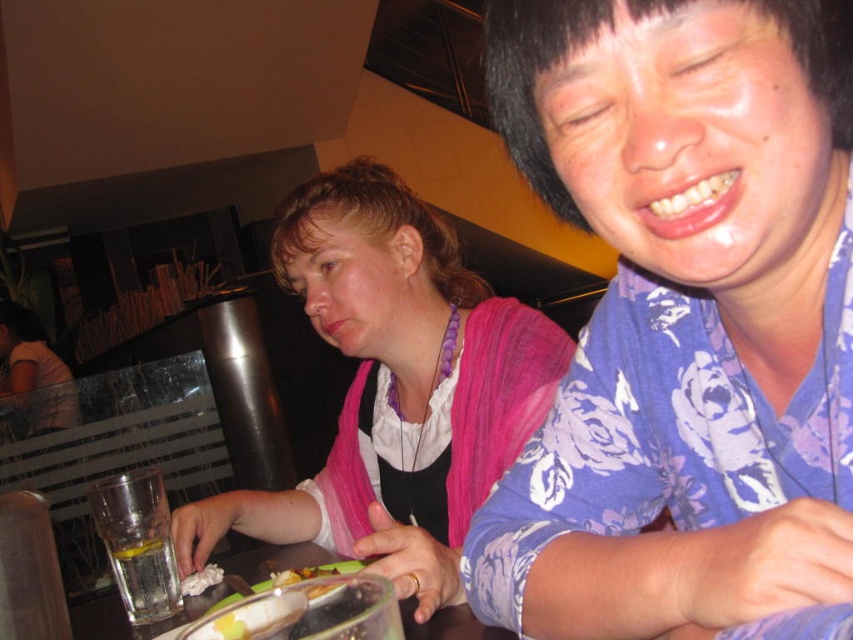
You are a photographer trying to capture a candid shot of the blue floral shirt at center and the clear glass table at center. Based on their heights, which object should you focus on first to ensure both are in frame?

The blue floral shirt at center is taller than the clear glass table at center, so you should focus on the blue floral shirt at center first to ensure both are in frame.

You are holding a 30 inch long ruler and want to place it on the clear glass table at center. Can you fit the ruler entirely on the table without any part hanging off the edge?

The distance between the clear glass table at center and the camera is 29.81 inches. Since the ruler is 30 inches long, it is slightly longer than the distance from the table to the camera, so the ruler cannot be placed entirely on the table without part of it hanging off the edge.